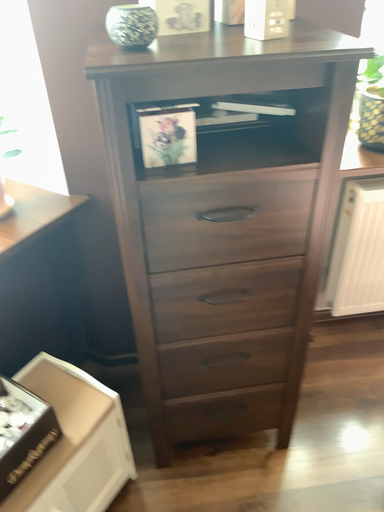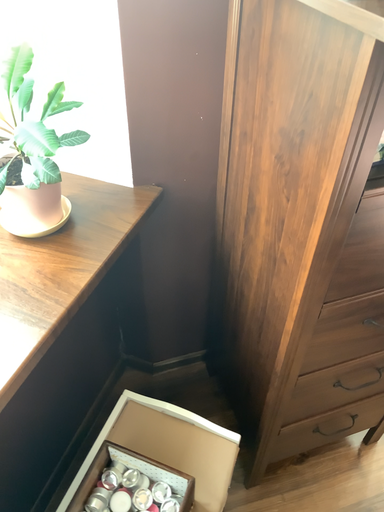
Question: Which way did the camera rotate in the video?

Choices:
 (A) rotated downward
 (B) rotated upward

Answer: (A)